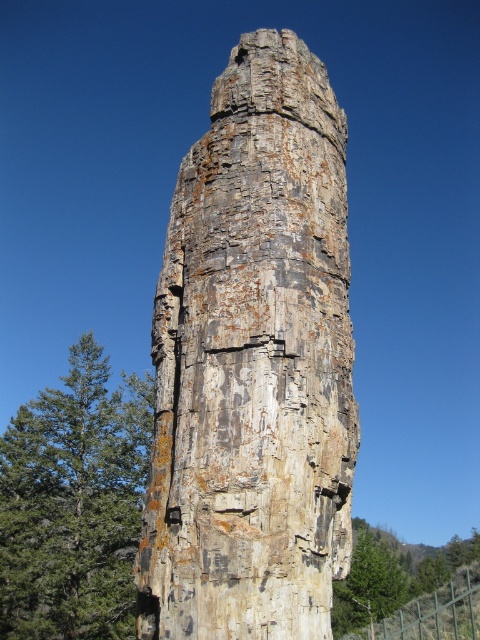
Question: Which point appears farthest from the camera in this image?

Choices:
 (A) click(264, 467)
 (B) click(61, 612)

Answer: (B)

Question: Observing the image, what is the correct spatial positioning of rusty stone column at center in reference to green leafy tree at center?

Choices:
 (A) right
 (B) left

Answer: (B)

Question: Which point is closer to the camera taking this photo?

Choices:
 (A) (235, 499)
 (B) (373, 620)

Answer: (A)

Question: Can you confirm if rusty stone column at center is positioned to the right of green textured tree at left?

Choices:
 (A) yes
 (B) no

Answer: (A)

Question: Which object is positioned farthest from the rusty stone column at center?

Choices:
 (A) green leafy tree at center
 (B) green textured tree at left

Answer: (A)

Question: Does rusty stone column at center have a greater width compared to green leafy tree at center?

Choices:
 (A) yes
 (B) no

Answer: (B)